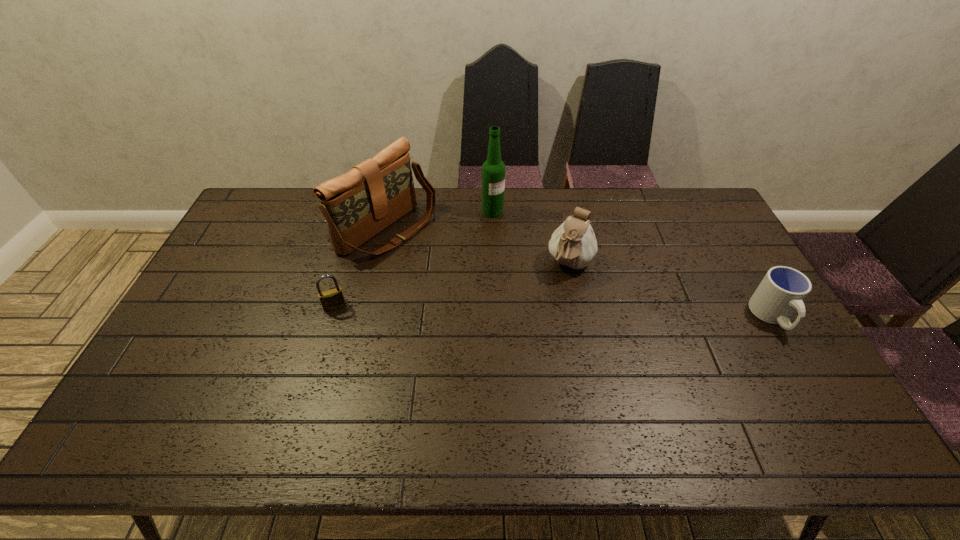
The width and height of the screenshot is (960, 540). I want to click on free point between the third object from left to right and the fourth shortest object, so click(440, 221).

Where is `free spot between the fourth shortest object and the pouch`? free spot between the fourth shortest object and the pouch is located at coordinates (478, 248).

I want to click on unoccupied position between the third tallest object and the tallest object, so click(x=531, y=238).

This screenshot has height=540, width=960. Identify the location of free space between the padlock and the cup. tap(553, 312).

At what (x,y) coordinates should I click in order to perform the action: click on free space that is in between the pouch and the padlock. Please return your answer as a coordinate pair (x, y). This screenshot has width=960, height=540. Looking at the image, I should click on (452, 286).

Identify which object is located as the third nearest to the rightmost object. Please provide its 2D coordinates. Your answer should be formatted as a tuple, i.e. [(x, y)], where the tuple contains the x and y coordinates of a point satisfying the conditions above.

[(357, 205)]

Select which object appears as the second closest to the padlock. Please provide its 2D coordinates. Your answer should be formatted as a tuple, i.e. [(x, y)], where the tuple contains the x and y coordinates of a point satisfying the conditions above.

[(493, 169)]

At what (x,y) coordinates should I click in order to perform the action: click on free spot that satisfies the following two spatial constraints: 1. on the back side of the padlock; 2. on the left side of the second object from right to left. Please return your answer as a coordinate pair (x, y). This screenshot has width=960, height=540. Looking at the image, I should click on (348, 264).